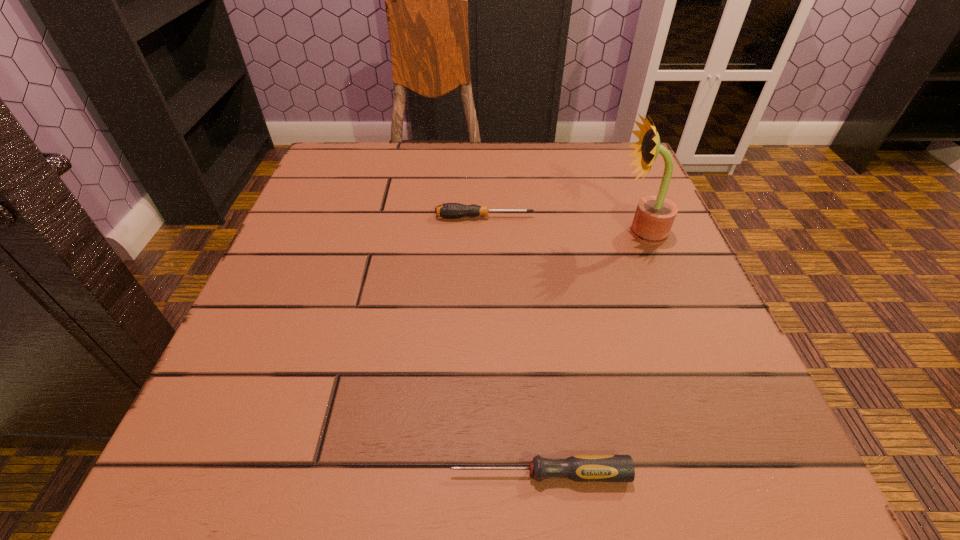
Identify the location of the tallest object. (654, 216).

At what (x,y) coordinates should I click in order to perform the action: click on sunflower. Please return your answer as a coordinate pair (x, y). The width and height of the screenshot is (960, 540). Looking at the image, I should click on (654, 216).

At what (x,y) coordinates should I click in order to perform the action: click on the farther screwdriver. Please return your answer as a coordinate pair (x, y). Image resolution: width=960 pixels, height=540 pixels. Looking at the image, I should click on (448, 210).

This screenshot has height=540, width=960. What are the coordinates of `the nearer screwdriver` in the screenshot? It's located at (581, 468).

You are a GUI agent. You are given a task and a screenshot of the screen. Output one action in this format:
    pyautogui.click(x=<x>, y=<y>)
    Task: Click on the free space located 0.220m on the face of the tallest object
    The height and width of the screenshot is (540, 960).
    Given the screenshot: What is the action you would take?
    pyautogui.click(x=500, y=233)

Locate an element on the screen. Image resolution: width=960 pixels, height=540 pixels. vacant space located 0.190m on the face of the tallest object is located at coordinates (516, 233).

The height and width of the screenshot is (540, 960). What are the coordinates of `blank area located on the face of the tallest object` in the screenshot? It's located at (500, 233).

Locate an element on the screen. Image resolution: width=960 pixels, height=540 pixels. free space located 0.130m on the left of the farther screwdriver is located at coordinates (371, 217).

The width and height of the screenshot is (960, 540). In order to click on free space located insert the nearest object into a screw head in this screenshot , I will do `click(176, 474)`.

You are a GUI agent. You are given a task and a screenshot of the screen. Output one action in this format:
    pyautogui.click(x=<x>, y=<y>)
    Task: Click on the vacant region located insert the nearest object into a screw head
    This screenshot has height=540, width=960.
    Given the screenshot: What is the action you would take?
    pyautogui.click(x=375, y=474)